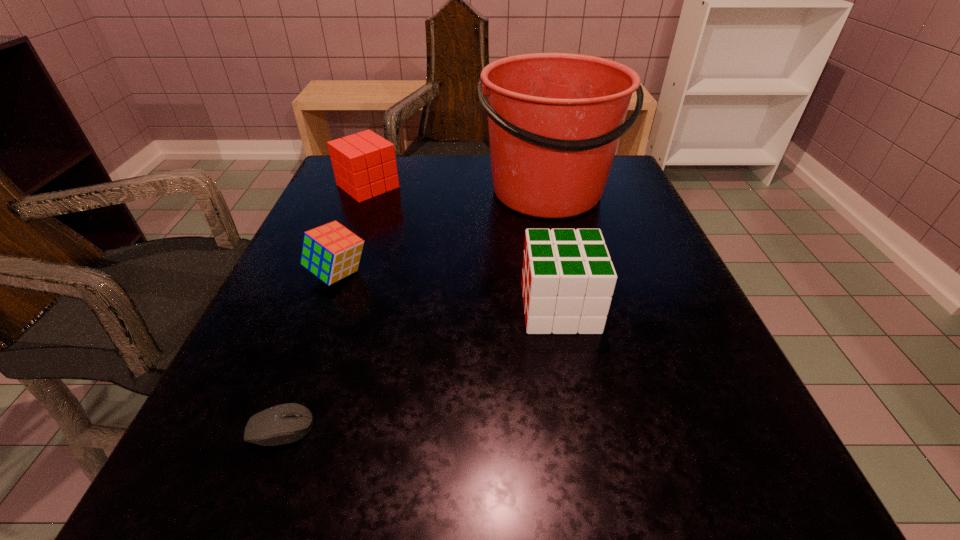
I want to click on vacant region located 0.060m on the left of the shortest object, so click(x=200, y=429).

Locate an element on the screen. bucket located in the far edge section of the desktop is located at coordinates (555, 119).

Find the location of a particular element. This screenshot has height=540, width=960. cube positioned at the far edge is located at coordinates (364, 164).

Find the location of a particular element. object situated at the near edge is located at coordinates (286, 423).

Identify the location of computer equipment at the left edge. The height and width of the screenshot is (540, 960). (286, 423).

In order to click on object that is positioned at the right edge in this screenshot , I will do `click(555, 119)`.

Where is `object positioned at the far left corner`? This screenshot has height=540, width=960. object positioned at the far left corner is located at coordinates (364, 164).

Where is `object that is positioned at the near left corner`? object that is positioned at the near left corner is located at coordinates (286, 423).

Find the location of `object at the far right corner`. object at the far right corner is located at coordinates pos(555,119).

In the image, there is a desktop. Identify the location of vacant space at the far edge. This screenshot has width=960, height=540. (440, 200).